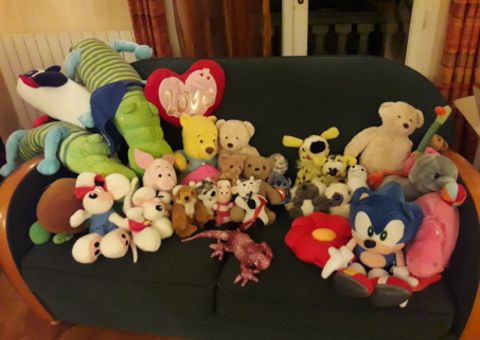
At what (x,y) coordinates should I click in order to perform the action: click on teddy bear. Please return your answer as a coordinate pair (x, y). Looking at the image, I should click on (390, 136), (199, 132), (245, 130), (231, 164), (257, 164), (438, 142).